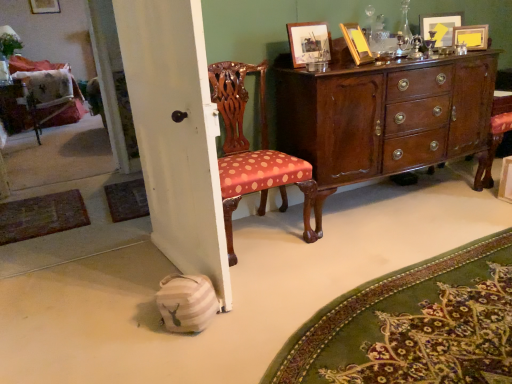
Find the location of a particular element. The width and height of the screenshot is (512, 384). vacant space underneath polished dark wood cabinet at center (from a real-world perspective) is located at coordinates (380, 201).